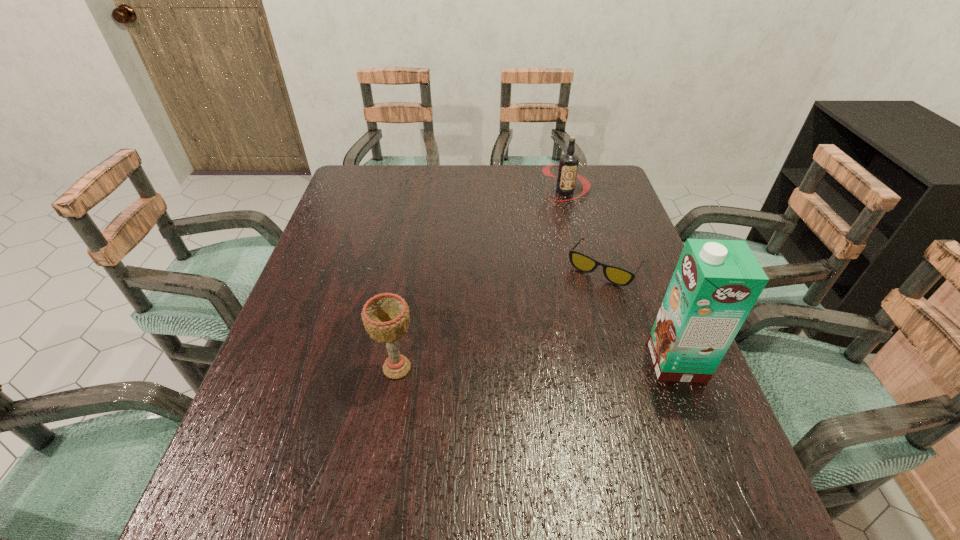
The image size is (960, 540). I want to click on vacant space at the right edge, so tap(626, 300).

Identify the location of vacant region at the far left corner of the desktop. The width and height of the screenshot is (960, 540). (384, 165).

Where is `vacant area at the far right corner of the desktop`? vacant area at the far right corner of the desktop is located at coordinates (588, 195).

At what (x,y) coordinates should I click in order to perform the action: click on free space at the near right corner of the desktop. Please return your answer as a coordinate pair (x, y). This screenshot has height=540, width=960. Looking at the image, I should click on (659, 437).

This screenshot has height=540, width=960. I want to click on empty location between the tallest object and the sunglasses, so click(x=640, y=314).

Locate an element on the screen. The image size is (960, 540). free space that is in between the carton and the leftmost object is located at coordinates (537, 365).

Find the location of a particular element. This screenshot has width=960, height=540. free area in between the second farthest object and the tallest object is located at coordinates click(x=640, y=314).

In order to click on free spot between the chalice and the farthest object in this screenshot , I will do `click(481, 280)`.

The image size is (960, 540). I want to click on vacant area that lies between the leftmost object and the tallest object, so click(x=537, y=365).

You are a GUI agent. You are given a task and a screenshot of the screen. Output one action in this format:
    pyautogui.click(x=<x>, y=<y>)
    Task: Click on the vacant point located between the second farthest object and the leftmost object
    This screenshot has width=960, height=540.
    Given the screenshot: What is the action you would take?
    pyautogui.click(x=500, y=318)